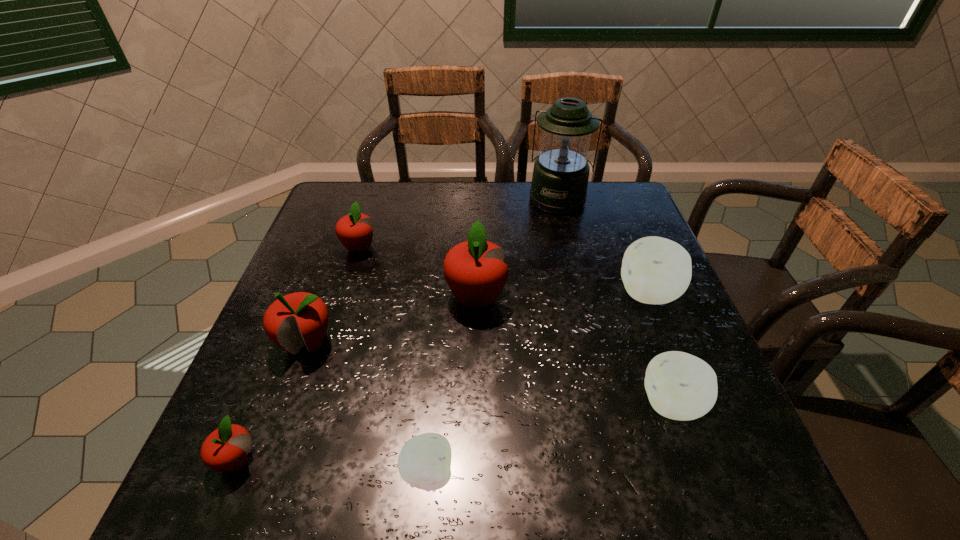
Find the location of a particular element. Image resolution: width=960 pixels, height=540 pixels. free spot between the nearest red apple and the nearest white apple is located at coordinates (332, 467).

This screenshot has height=540, width=960. I want to click on vacant space that's between the second nearest white apple and the second biggest red apple, so click(x=490, y=373).

Identify the location of empty location between the second farthest object and the tallest apple. (418, 272).

At what (x,y) coordinates should I click in order to perform the action: click on free area in between the nearest red apple and the farthest white apple. Please return your answer as a coordinate pair (x, y). This screenshot has width=960, height=540. Looking at the image, I should click on (443, 377).

You are a GUI agent. You are given a task and a screenshot of the screen. Output one action in this format:
    pyautogui.click(x=<x>, y=<y>)
    Task: Click on the free point between the green lantern and the farthest red apple
    This screenshot has height=540, width=960.
    Given the screenshot: What is the action you would take?
    pyautogui.click(x=459, y=223)

This screenshot has height=540, width=960. What are the coordinates of `unoccupied position between the tallest object and the fourth nearest apple` in the screenshot? It's located at (432, 271).

Locate an element on the screen. The height and width of the screenshot is (540, 960). free space between the biggest red apple and the nearest red apple is located at coordinates (356, 379).

The image size is (960, 540). Identify the location of vacant region between the leftmost white apple and the third farthest red apple. (368, 408).

Identify the location of vacant area between the farthest object and the second smallest white apple. (615, 301).

Select which object appears as the fifth closest to the farthest red apple. Please provide its 2D coordinates. Your answer should be formatted as a tuple, i.e. [(x, y)], where the tuple contains the x and y coordinates of a point satisfying the conditions above.

[(424, 462)]